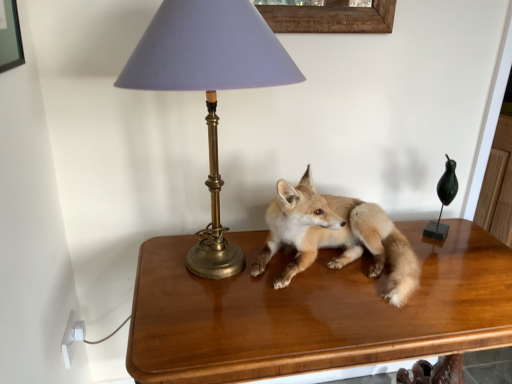
Locate an element on the screen. The image size is (512, 384). free spot below light brown fur fox at center (from a real-world perspective) is located at coordinates (348, 281).